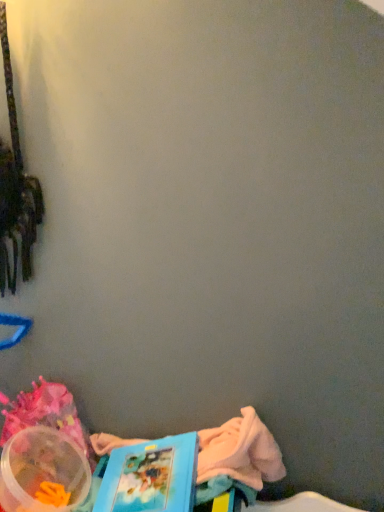
Question: Is blue cardboard book at lower left thinner than translucent plastic container at lower left?

Choices:
 (A) no
 (B) yes

Answer: (A)

Question: Is blue cardboard book at lower left next to translucent plastic container at lower left and touching it?

Choices:
 (A) no
 (B) yes

Answer: (A)

Question: Is blue cardboard book at lower left further to camera compared to translucent plastic container at lower left?

Choices:
 (A) yes
 (B) no

Answer: (B)

Question: Is blue cardboard book at lower left smaller than translucent plastic container at lower left?

Choices:
 (A) no
 (B) yes

Answer: (A)

Question: From the image's perspective, does blue cardboard book at lower left appear lower than translucent plastic container at lower left?

Choices:
 (A) yes
 (B) no

Answer: (B)

Question: Considering the relative sizes of blue cardboard book at lower left and translucent plastic container at lower left in the image provided, is blue cardboard book at lower left wider than translucent plastic container at lower left?

Choices:
 (A) no
 (B) yes

Answer: (B)

Question: From a real-world perspective, is translucent plastic container at lower left beneath blue cardboard book at lower left?

Choices:
 (A) no
 (B) yes

Answer: (B)

Question: Is translucent plastic container at lower left in front of blue cardboard book at lower left?

Choices:
 (A) yes
 (B) no

Answer: (B)

Question: Can you confirm if translucent plastic container at lower left is positioned to the right of blue cardboard book at lower left?

Choices:
 (A) yes
 (B) no

Answer: (B)

Question: Considering the relative sizes of translucent plastic container at lower left and blue cardboard book at lower left in the image provided, is translucent plastic container at lower left wider than blue cardboard book at lower left?

Choices:
 (A) no
 (B) yes

Answer: (A)

Question: Considering the relative sizes of translucent plastic container at lower left and blue cardboard book at lower left in the image provided, is translucent plastic container at lower left taller than blue cardboard book at lower left?

Choices:
 (A) no
 (B) yes

Answer: (A)

Question: Is translucent plastic container at lower left looking in the opposite direction of blue cardboard book at lower left?

Choices:
 (A) no
 (B) yes

Answer: (A)

Question: Considering the positions of translucent plastic container at lower left and blue cardboard book at lower left in the image, is translucent plastic container at lower left taller or shorter than blue cardboard book at lower left?

Choices:
 (A) tall
 (B) short

Answer: (B)